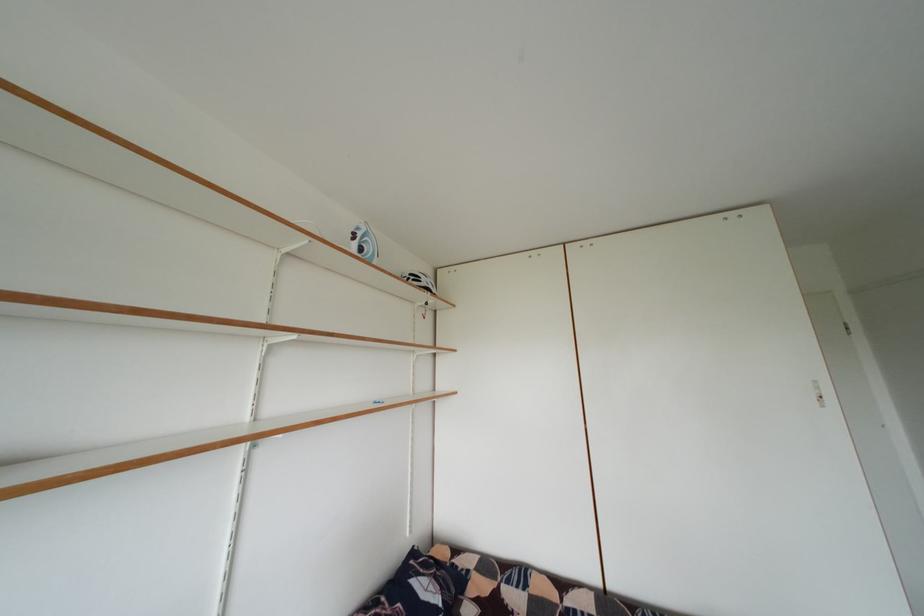
Locate an element on the screen. The image size is (924, 616). door handle is located at coordinates (462, 308).